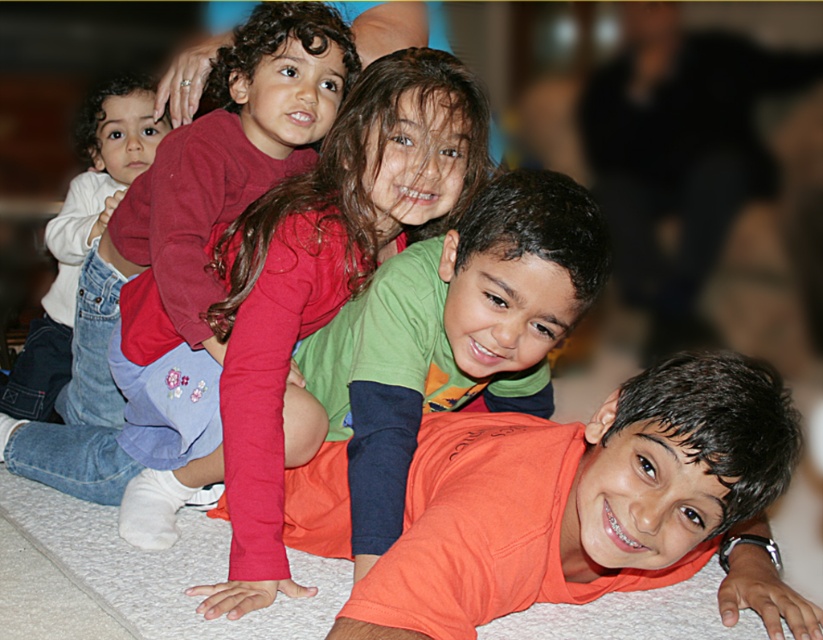
Question: Which point appears farthest from the camera in this image?

Choices:
 (A) (453, 554)
 (B) (336, 349)

Answer: (B)

Question: Which point appears farthest from the camera in this image?

Choices:
 (A) click(372, 324)
 (B) click(70, 353)
 (C) click(742, 374)

Answer: (B)

Question: From the image, what is the correct spatial relationship of orange cotton shirt at lower right in relation to matte red shirt at upper left?

Choices:
 (A) left
 (B) right

Answer: (B)

Question: Is the position of orange cotton shirt at lower right more distant than that of orange cotton shirt at center?

Choices:
 (A) yes
 (B) no

Answer: (B)

Question: Does orange cotton shirt at lower right appear over matte red shirt at upper left?

Choices:
 (A) no
 (B) yes

Answer: (A)

Question: Which of these objects is positioned farthest from the orange cotton shirt at lower right?

Choices:
 (A) matte red shirt at upper left
 (B) white denim jeans at left
 (C) orange cotton shirt at center

Answer: (B)